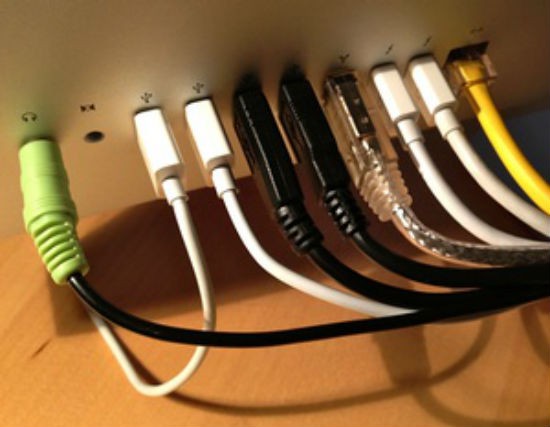
This screenshot has height=427, width=550. In order to click on data cables in this screenshot , I will do `click(476, 80)`, `click(442, 119)`, `click(405, 126)`, `click(367, 138)`, `click(316, 142)`, `click(278, 173)`, `click(220, 144)`, `click(158, 162)`.